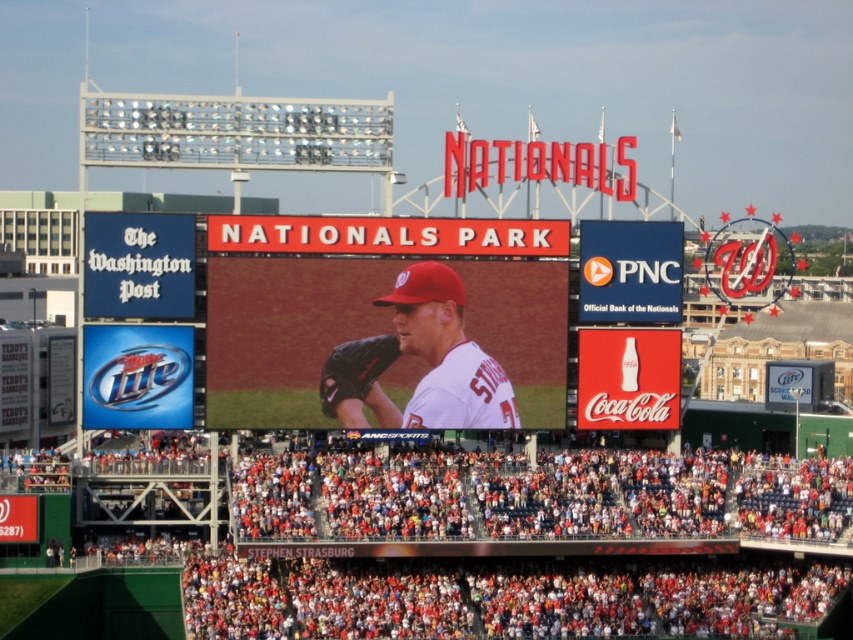
You are a photographer standing at the edge of the field at Nationals Park. You want to take a photo of the white matte baseball uniform at center and the black leather glove at center. If your camera can focus on objects within a 5 feet range, will both items be in focus?

The distance between the white matte baseball uniform at center and the black leather glove at center is 5.02 feet, which is slightly beyond the camera focus range of 5 feet. Therefore, both items may not be in focus simultaneously.

You are a photographer standing at the center of Nationals Park. You want to take a photo of the white matte baseball uniform at center. Where should you point your camera?

You should point your camera at point [424,358] to capture the white matte baseball uniform at center.

You are a photographer at Nationals Park and need to capture a clear shot of both the white matte scoreboard at center and the white matte baseball uniform at center. Since you want to emphasize the scoreboard, which object should you focus on first and why?

You should focus on the white matte scoreboard at center first because it is bigger than the white matte baseball uniform at center, making it the more prominent subject in the scene.